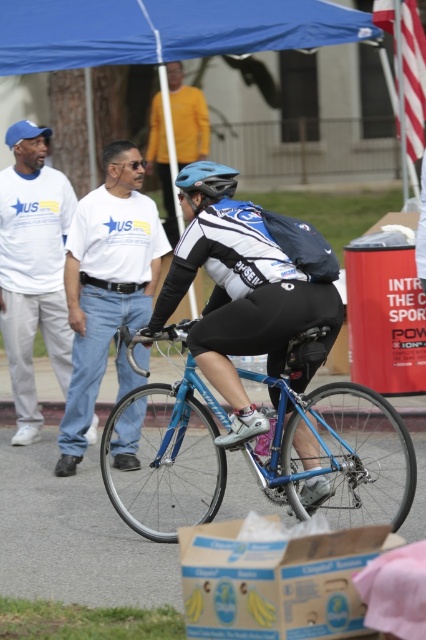
You are standing at the event and want to know which point is closer to you. The points are point [256,48] and point [195,184]. Which one is closer?

Point [256,48] is further to the viewer than point [195,184], so the closer point is point [195,184].